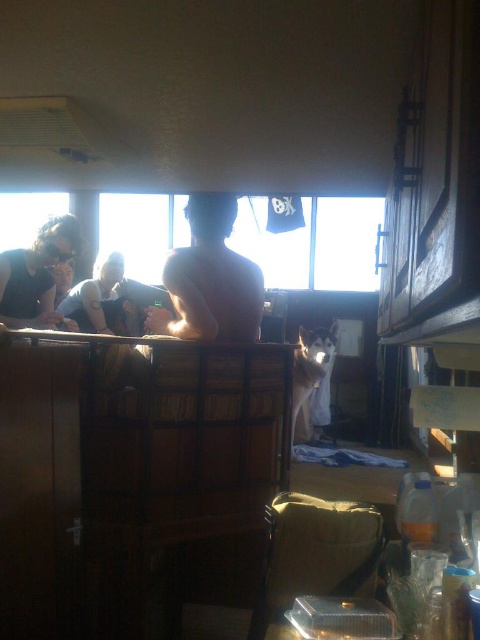
How distant is transparent glass window at upper center from naked skin at center?

transparent glass window at upper center and naked skin at center are 2.87 meters apart.

Can you confirm if transparent glass window at upper center is positioned above naked skin at center?

Yes, transparent glass window at upper center is above naked skin at center.

Locate an element on the screen. Image resolution: width=480 pixels, height=640 pixels. transparent glass window at upper center is located at coordinates (313, 243).

Find the location of a particular element. transparent glass window at upper center is located at coordinates (313, 243).

Can you confirm if transparent glass window at upper center is positioned to the right of matte black shirt at left?

Indeed, transparent glass window at upper center is positioned on the right side of matte black shirt at left.

Which of these two, transparent glass window at upper center or matte black shirt at left, stands taller?

Standing taller between the two is transparent glass window at upper center.

Find the location of a particular element. The height and width of the screenshot is (640, 480). transparent glass window at upper center is located at coordinates (313, 243).

Can you confirm if naked skin at center is positioned to the left of matte black shirt at left?

Incorrect, naked skin at center is not on the left side of matte black shirt at left.

The width and height of the screenshot is (480, 640). What do you see at coordinates (210, 280) in the screenshot?
I see `naked skin at center` at bounding box center [210, 280].

The image size is (480, 640). Find the location of `naked skin at center`. naked skin at center is located at coordinates (210, 280).